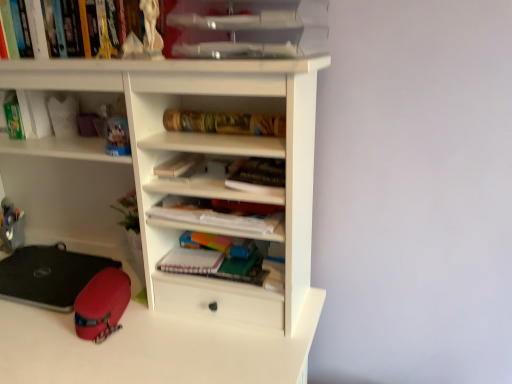
In order to face white matte paper at center, the 1th paperback book when ordered from top to bottom, should I rotate leftwards or rightwards?

Rotate left and turn 9.786 degrees.

This screenshot has width=512, height=384. Identify the location of white matte notebook at center, which ranks as the 1th paperback book in bottom-to-top order. (191, 261).

The height and width of the screenshot is (384, 512). What do you see at coordinates (249, 28) in the screenshot? I see `clear plastic trays at upper center` at bounding box center [249, 28].

Measure the distance between point [266,183] and camera.

The depth of point [266,183] is 38.31 inches.

Locate an element on the screen. The width and height of the screenshot is (512, 384). white matte paper at center, which appears as the second paperback book when ordered from the bottom is located at coordinates (177, 164).

Is point (174, 166) closer to viewer compared to point (272, 126)?

No.

Is gold metallic tube at center, arranged as the third book when ordered from the bottom, at the back of white matte paper at center, which appears as the second paperback book when ordered from the bottom?

white matte paper at center, which appears as the second paperback book when ordered from the bottom, does not have its back to gold metallic tube at center, arranged as the third book when ordered from the bottom.

Are white matte paper at center, the 1th paperback book when ordered from top to bottom, and gold metallic tube at center, the second book viewed from the top, located far from each other?

No.

Between white matte paper at center, which appears as the second paperback book when ordered from the bottom, and gold metallic tube at center, arranged as the third book when ordered from the bottom, which one has smaller size?

white matte paper at center, which appears as the second paperback book when ordered from the bottom, is smaller.

Is rubberized red case at lower left next to hardcover book at center, the 3th book in the top-to-bottom sequence, and touching it?

No, rubberized red case at lower left is not making contact with hardcover book at center, the 3th book in the top-to-bottom sequence.

Between rubberized red case at lower left and hardcover book at center, the 3th book in the top-to-bottom sequence, which one is positioned in front?

hardcover book at center, the 3th book in the top-to-bottom sequence, is more forward.

From the picture: Is hardcover book at center, the 3th book in the top-to-bottom sequence, located within rubberized red case at lower left?

No, hardcover book at center, the 3th book in the top-to-bottom sequence, is not surrounded by rubberized red case at lower left.

Which point is more distant from viewer, (42, 289) or (277, 172)?

The point (42, 289) is more distant.

Is hardcover book at upper left, which appears as the 4th book when ordered from the bottom, located outside white matte paper at center, the 1th paperback book when ordered from top to bottom?

Yes, hardcover book at upper left, which appears as the 4th book when ordered from the bottom, is outside of white matte paper at center, the 1th paperback book when ordered from top to bottom.

Does hardcover book at upper left, which appears as the 4th book when ordered from the bottom, touch white matte paper at center, the 1th paperback book when ordered from top to bottom?

hardcover book at upper left, which appears as the 4th book when ordered from the bottom, and white matte paper at center, the 1th paperback book when ordered from top to bottom, are not in contact.

In the scene shown: Is hardcover book at upper left, which appears as the 4th book when ordered from the bottom, to the right of white matte paper at center, which appears as the second paperback book when ordered from the bottom, from the viewer's perspective?

Incorrect, hardcover book at upper left, which appears as the 4th book when ordered from the bottom, is not on the right side of white matte paper at center, which appears as the second paperback book when ordered from the bottom.

At what (x,y) coordinates should I click in order to perform the action: click on the 2nd paperback book behind the hardcover book at upper left, the 1th book when ordered from top to bottom. Please return your answer as a coordinate pair (x, y). The height and width of the screenshot is (384, 512). Looking at the image, I should click on (177, 164).

Which of these two, gold metallic tube at center, arranged as the third book when ordered from the bottom, or clear plastic trays at upper center, is wider?

clear plastic trays at upper center is wider.

From the image's perspective, which one is positioned higher, gold metallic tube at center, the second book viewed from the top, or clear plastic trays at upper center?

From the image's view, clear plastic trays at upper center is above.

From a real-world perspective, is gold metallic tube at center, arranged as the third book when ordered from the bottom, positioned under clear plastic trays at upper center based on gravity?

Yes, from a real-world perspective, gold metallic tube at center, arranged as the third book when ordered from the bottom, is beneath clear plastic trays at upper center.

Considering the positions of objects gold metallic tube at center, the second book viewed from the top, and clear plastic trays at upper center in the image provided, who is more to the right, gold metallic tube at center, the second book viewed from the top, or clear plastic trays at upper center?

clear plastic trays at upper center is more to the right.

In the scene shown: From a real-world perspective, is rubberized red case at lower left below white matte notebook at center, which ranks as the 1th paperback book in bottom-to-top order?

Yes, from a real-world perspective, rubberized red case at lower left is below white matte notebook at center, which ranks as the 1th paperback book in bottom-to-top order.

Is rubberized red case at lower left further to the viewer compared to white matte notebook at center, which ranks as the 1th paperback book in bottom-to-top order?

That is False.

Between rubberized red case at lower left and white matte notebook at center, which ranks as the 1th paperback book in bottom-to-top order, which one has smaller size?

With smaller size is white matte notebook at center, which ranks as the 1th paperback book in bottom-to-top order.

Is rubberized red case at lower left turned away from white matte notebook at center, which ranks as the second paperback book in top-to-bottom order?

No.

Does clear plastic trays at upper center appear on the left side of rubberized red case at lower left?

Incorrect, clear plastic trays at upper center is not on the left side of rubberized red case at lower left.

Is rubberized red case at lower left a part of clear plastic trays at upper center?

Definitely not — rubberized red case at lower left is not inside clear plastic trays at upper center.

Does clear plastic trays at upper center turn towards rubberized red case at lower left?

No, clear plastic trays at upper center does not turn towards rubberized red case at lower left.

What's the angular difference between clear plastic trays at upper center and rubberized red case at lower left's facing directions?

The facing directions of clear plastic trays at upper center and rubberized red case at lower left are 1.32 degrees apart.

Who is taller, hardcover book at center, the 3th book in the top-to-bottom sequence, or gold metallic tube at center, the second book viewed from the top?

Standing taller between the two is gold metallic tube at center, the second book viewed from the top.

Is hardcover book at center, the 3th book in the top-to-bottom sequence, positioned with its back to gold metallic tube at center, arranged as the third book when ordered from the bottom?

No, hardcover book at center, the 3th book in the top-to-bottom sequence,'s orientation is not away from gold metallic tube at center, arranged as the third book when ordered from the bottom.

Is hardcover book at center, the 3th book in the top-to-bottom sequence, not within gold metallic tube at center, arranged as the third book when ordered from the bottom?

Yes.

Is hardcover book at center, the 2th book when ordered from bottom to top, with gold metallic tube at center, arranged as the third book when ordered from the bottom?

They are not placed beside each other.

There is a gold metallic tube at center, arranged as the third book when ordered from the bottom. At what (x,y) coordinates should I click in order to perform the action: click on the 1st paperback book below it (from a real-world perspective). Please return your answer as a coordinate pair (x, y). This screenshot has height=384, width=512. Looking at the image, I should click on (177, 164).

The height and width of the screenshot is (384, 512). Identify the location of the 2nd book above when counting from the rubberized red case at lower left (from the image's perspective). (257, 174).

Estimate the real-world distances between objects in this image. Which object is further from rubberized red case at lower left, gold metallic tube at center, arranged as the third book when ordered from the bottom, or clear plastic trays at upper center?

Among the two, clear plastic trays at upper center is located further to rubberized red case at lower left.

Considering their positions, is white matte notebook at center, which ranks as the second paperback book in top-to-bottom order, positioned further to white matte paper at center, the 1th paperback book when ordered from top to bottom, than gold metallic tube at center, the second book viewed from the top?

white matte notebook at center, which ranks as the second paperback book in top-to-bottom order, is further to white matte paper at center, the 1th paperback book when ordered from top to bottom.

Based on their spatial positions, is clear plastic trays at upper center or hardcover book at center, the 2th book when ordered from bottom to top, further from white matte notebook at center, which ranks as the second paperback book in top-to-bottom order?

Among the two, clear plastic trays at upper center is located further to white matte notebook at center, which ranks as the second paperback book in top-to-bottom order.

Considering their positions, is white matte paper at center, which appears as the second paperback book when ordered from the bottom, positioned further to gold metallic tube at center, arranged as the third book when ordered from the bottom, than white matte notebook at center, which ranks as the 1th paperback book in bottom-to-top order?

The object further to gold metallic tube at center, arranged as the third book when ordered from the bottom, is white matte notebook at center, which ranks as the 1th paperback book in bottom-to-top order.

Looking at the image, which one is located closer to rubberized red case at lower left, rubberized red case at lower left or white matte notebook at center, which ranks as the 1th paperback book in bottom-to-top order?

rubberized red case at lower left is closer to rubberized red case at lower left.

From the image, which object appears to be farther from gold metallic tube at center, arranged as the third book when ordered from the bottom, white matte paper at center, the 1th paperback book when ordered from top to bottom, or hardcover book at upper left, which appears as the 4th book when ordered from the bottom?

hardcover book at upper left, which appears as the 4th book when ordered from the bottom, lies further to gold metallic tube at center, arranged as the third book when ordered from the bottom, than the other object.

From the image, which object appears to be nearer to white matte paper at center, which appears as the second paperback book when ordered from the bottom, rubberized red case at lower left or clear plastic trays at upper center?

Based on the image, clear plastic trays at upper center appears to be nearer to white matte paper at center, which appears as the second paperback book when ordered from the bottom.

Looking at the image, which one is located further to clear plastic trays at upper center, hardcover book at center, the 3th book in the top-to-bottom sequence, or hardcover book at upper left, the 1th book when ordered from top to bottom?

Among the two, hardcover book at upper left, the 1th book when ordered from top to bottom, is located further to clear plastic trays at upper center.

This screenshot has width=512, height=384. I want to click on luggage between rubberized red case at lower left and white matte notebook at center, which ranks as the 1th paperback book in bottom-to-top order, in the horizontal direction, so click(x=102, y=304).

You are a GUI agent. You are given a task and a screenshot of the screen. Output one action in this format:
    pyautogui.click(x=<x>, y=<y>)
    Task: Click on the paperback book between white matte paper at center, the 1th paperback book when ordered from top to bottom, and rubberized red case at lower left, in the vertical direction
    This screenshot has width=512, height=384.
    Given the screenshot: What is the action you would take?
    pyautogui.click(x=191, y=261)

Find the location of a particular element. This screenshot has width=512, height=384. book that lies between clear plastic trays at upper center and hardcover book at center, the 3th book in the top-to-bottom sequence, from top to bottom is located at coordinates (224, 123).

This screenshot has height=384, width=512. What are the coordinates of `book that lies between hardcover book at center, the 2th book when ordered from bottom to top, and white matte notebook at center, which ranks as the second paperback book in top-to-bottom order, from top to bottom` in the screenshot? It's located at (214, 215).